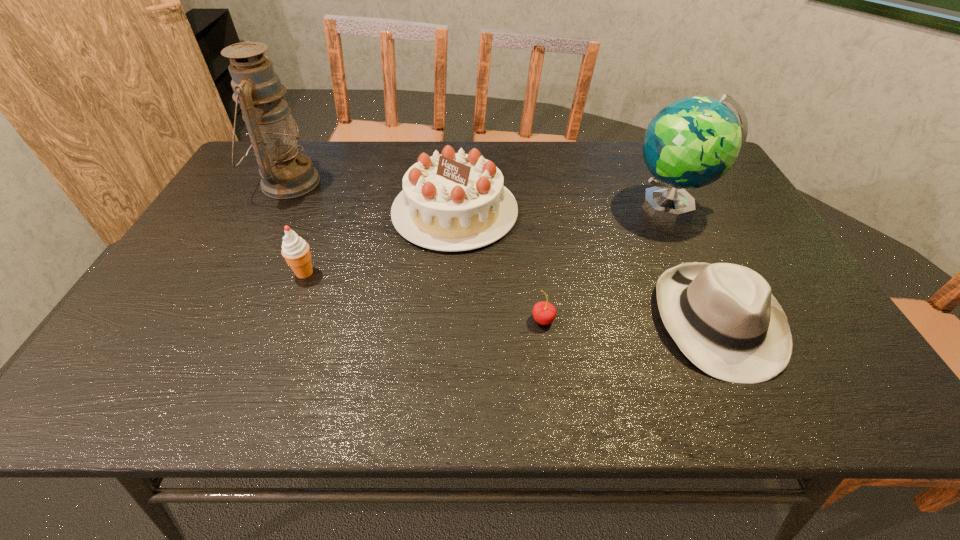
Locate an element on the screen. the tallest object is located at coordinates (285, 173).

Locate an element on the screen. The image size is (960, 540). the leftmost object is located at coordinates (285, 173).

You are a GUI agent. You are given a task and a screenshot of the screen. Output one action in this format:
    pyautogui.click(x=<x>, y=<y>)
    Task: Click on the second tallest object
    This screenshot has height=540, width=960.
    Given the screenshot: What is the action you would take?
    pyautogui.click(x=692, y=142)

Identify the location of birthday cake. This screenshot has width=960, height=540. coord(451,201).

What are the coordinates of `the second object from left to right` in the screenshot? It's located at (295, 250).

Find the location of a particular element. The width and height of the screenshot is (960, 540). fedora is located at coordinates (723, 317).

Where is `the shortest object`? This screenshot has width=960, height=540. the shortest object is located at coordinates (544, 313).

The image size is (960, 540). In order to click on the third object from right to left in this screenshot , I will do `click(544, 313)`.

Where is `vacant space located on the right of the tallest object`? The width and height of the screenshot is (960, 540). vacant space located on the right of the tallest object is located at coordinates [x=381, y=183].

At what (x,y) coordinates should I click in order to perform the action: click on vacant space located 0.350m on the front surface of the second tallest object. Please return your answer as a coordinate pair (x, y). The width and height of the screenshot is (960, 540). Looking at the image, I should click on (507, 204).